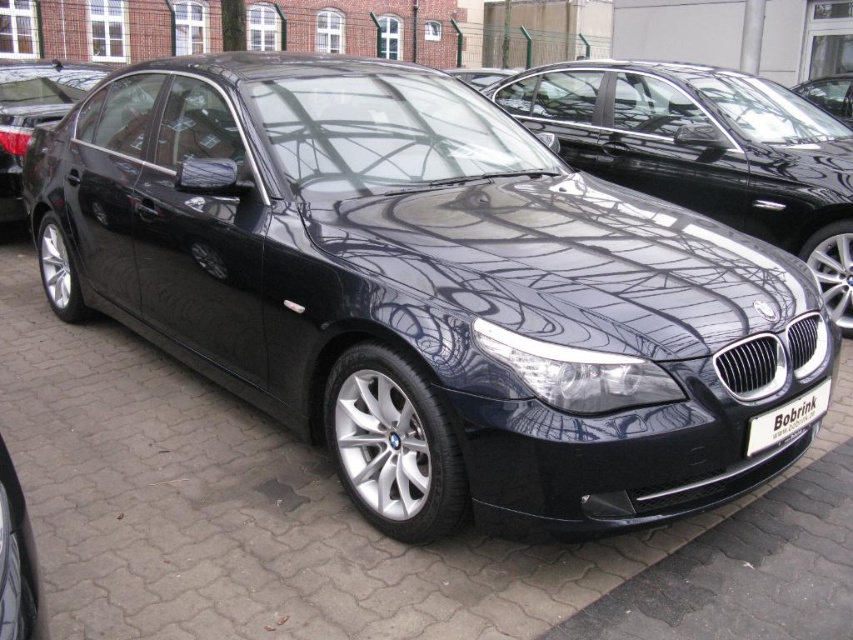
Based on the photo, does glossy black car at center have a lesser height compared to glossy black car at lower left?

In fact, glossy black car at center may be taller than glossy black car at lower left.

Which is in front, point (772, 177) or point (26, 556)?

Point (26, 556) is more forward.

I want to click on glossy black car at center, so click(x=705, y=150).

Can you confirm if glossy black car at center is positioned to the left of white plastic license plate at center?

No, glossy black car at center is not to the left of white plastic license plate at center.

Looking at this image, can you confirm if glossy black car at center is thinner than white plastic license plate at center?

Incorrect, glossy black car at center's width is not less than white plastic license plate at center's.

Image resolution: width=853 pixels, height=640 pixels. In order to click on glossy black car at center in this screenshot , I will do `click(705, 150)`.

Which is above, glossy black car at lower left or white plastic license plate at center?

white plastic license plate at center is higher up.

What are the coordinates of `glossy black car at lower left` in the screenshot? It's located at (15, 557).

Identify the location of glossy black car at lower left. (15, 557).